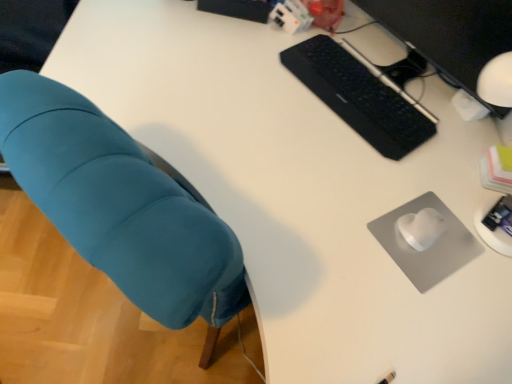
The image size is (512, 384). Find the location of `vacant location below black matte computer monitor at upper right (from a real-world perspective)`. vacant location below black matte computer monitor at upper right (from a real-world perspective) is located at coordinates (409, 72).